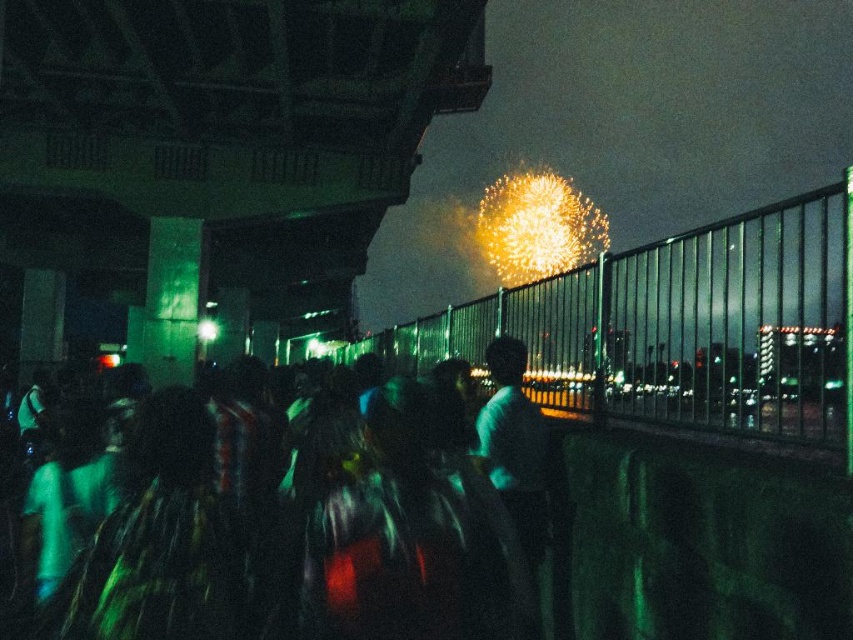
Question: Can you confirm if metallic fence at upper center is positioned to the right of dark matte crowd at center?

Choices:
 (A) no
 (B) yes

Answer: (A)

Question: Considering the relative positions of metallic fence at upper center and dark matte crowd at center in the image provided, where is metallic fence at upper center located with respect to dark matte crowd at center?

Choices:
 (A) above
 (B) below

Answer: (B)

Question: Which point appears closest to the camera in this image?

Choices:
 (A) (442, 611)
 (B) (451, 307)

Answer: (A)

Question: Is metallic fence at upper center wider than dark matte crowd at center?

Choices:
 (A) yes
 (B) no

Answer: (A)